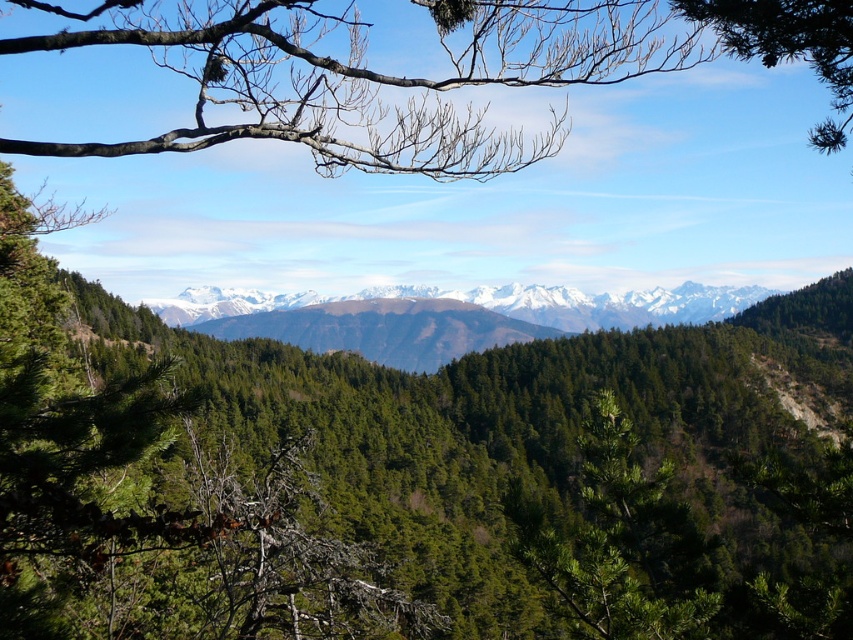
Does bare branches at upper center have a lesser height compared to snowy rocky mountain range at center?

No, bare branches at upper center is not shorter than snowy rocky mountain range at center.

Can you confirm if bare branches at upper center is thinner than snowy rocky mountain range at center?

No, bare branches at upper center is not thinner than snowy rocky mountain range at center.

You are a GUI agent. You are given a task and a screenshot of the screen. Output one action in this format:
    pyautogui.click(x=<x>, y=<y>)
    Task: Click on the bare branches at upper center
    This screenshot has width=853, height=640.
    Given the screenshot: What is the action you would take?
    pyautogui.click(x=432, y=77)

Looking at this image, is green matte tree at center to the right of snowy rocky mountain range at center from the viewer's perspective?

In fact, green matte tree at center is to the left of snowy rocky mountain range at center.

Which is more to the right, green matte tree at center or snowy rocky mountain range at center?

snowy rocky mountain range at center is more to the right.

You are a GUI agent. You are given a task and a screenshot of the screen. Output one action in this format:
    pyautogui.click(x=<x>, y=<y>)
    Task: Click on the green matte tree at center
    The height and width of the screenshot is (640, 853).
    Given the screenshot: What is the action you would take?
    pyautogui.click(x=619, y=541)

Is the position of bare branches at upper center more distant than that of green matte tree at center?

No.

Between bare branches at upper center and green matte tree at center, which one has more height?

bare branches at upper center is taller.

Identify the location of bare branches at upper center. (432, 77).